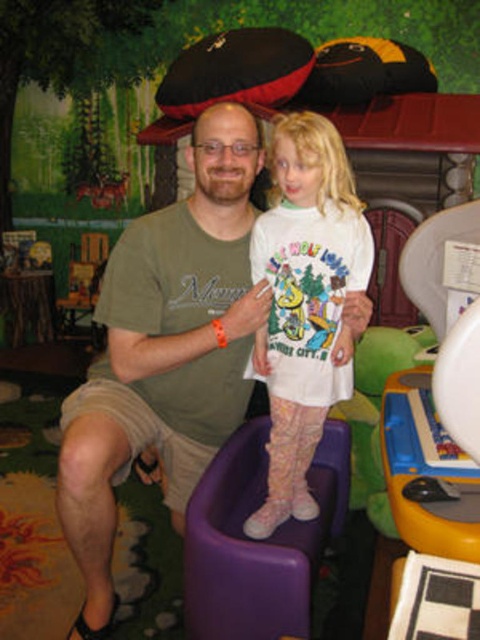
Can you confirm if green cotton shirt at center is wider than white matte t-shirt at center?

Indeed, green cotton shirt at center has a greater width compared to white matte t-shirt at center.

The height and width of the screenshot is (640, 480). Describe the element at coordinates (167, 346) in the screenshot. I see `green cotton shirt at center` at that location.

In order to click on green cotton shirt at center in this screenshot , I will do `click(167, 346)`.